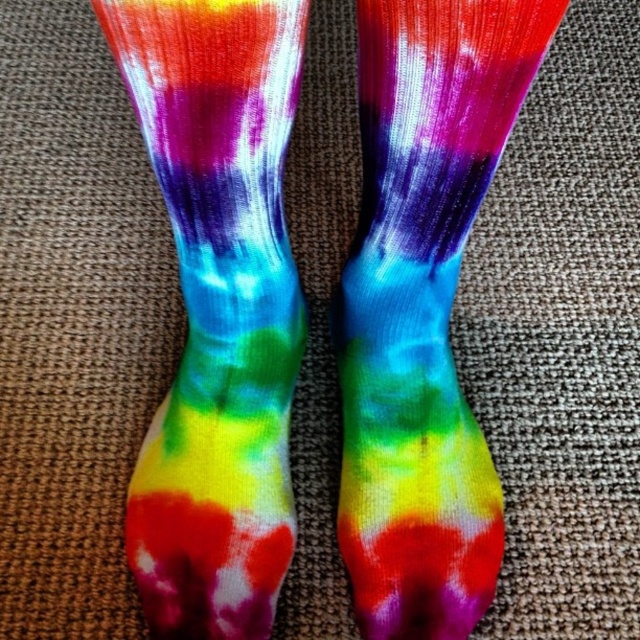
Question: Does tie-dye fabric socks at center appear on the right side of rainbow tie-dye sock at center?

Choices:
 (A) yes
 (B) no

Answer: (B)

Question: In this image, where is tie-dye fabric socks at center located relative to rainbow tie-dye sock at center?

Choices:
 (A) right
 (B) left

Answer: (B)

Question: Can you confirm if tie-dye fabric socks at center is positioned above rainbow tie-dye sock at center?

Choices:
 (A) yes
 (B) no

Answer: (A)

Question: Which of the following is the closest to the observer?

Choices:
 (A) tie-dye fabric socks at center
 (B) rainbow tie-dye sock at center

Answer: (A)